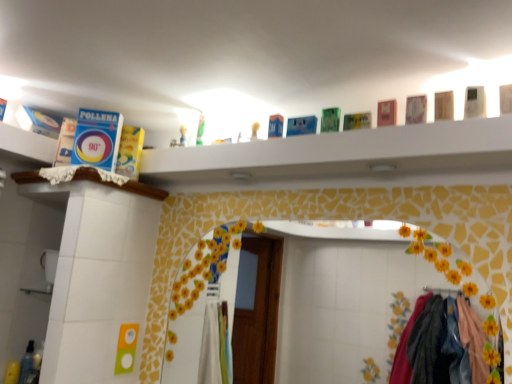
The height and width of the screenshot is (384, 512). Describe the element at coordinates (122, 185) in the screenshot. I see `wooden ledge at upper left, the 2th ledge viewed from the top` at that location.

Describe the element at coordinates (341, 153) in the screenshot. I see `blue cardboard box at upper center, arranged as the first ledge when viewed from the top` at that location.

Where is `translucent plastic bottle at lower left`? Image resolution: width=512 pixels, height=384 pixels. translucent plastic bottle at lower left is located at coordinates (27, 365).

Can you confirm if wooden ledge at upper left, the 2th ledge viewed from the top, is positioned to the right of translucent plastic bottle at lower left?

Yes, wooden ledge at upper left, the 2th ledge viewed from the top, is to the right of translucent plastic bottle at lower left.

Is translucent plastic bottle at lower left a part of wooden ledge at upper left, marked as the 1th ledge in a bottom-to-top arrangement?

No, translucent plastic bottle at lower left is not a part of wooden ledge at upper left, marked as the 1th ledge in a bottom-to-top arrangement.

Considering the sizes of objects wooden ledge at upper left, marked as the 1th ledge in a bottom-to-top arrangement, and translucent plastic bottle at lower left in the image provided, who is shorter, wooden ledge at upper left, marked as the 1th ledge in a bottom-to-top arrangement, or translucent plastic bottle at lower left?

wooden ledge at upper left, marked as the 1th ledge in a bottom-to-top arrangement, is shorter.

Is point (161, 197) positioned in front of point (28, 355)?

No.

Consider the image. Is blue cardboard box at upper center, arranged as the first ledge when viewed from the top, in front of or behind translucent plastic bottle at lower left in the image?

In the image, blue cardboard box at upper center, arranged as the first ledge when viewed from the top, appears in front of translucent plastic bottle at lower left.

Is blue cardboard box at upper center, arranged as the first ledge when viewed from the top, wider or thinner than translucent plastic bottle at lower left?

blue cardboard box at upper center, arranged as the first ledge when viewed from the top, is wider than translucent plastic bottle at lower left.

Is blue cardboard box at upper center, arranged as the first ledge when viewed from the top, taller than translucent plastic bottle at lower left?

In fact, blue cardboard box at upper center, arranged as the first ledge when viewed from the top, may be shorter than translucent plastic bottle at lower left.

Is blue cardboard box at upper center, placed as the 2th ledge when sorted from bottom to top, inside or outside of translucent plastic bottle at lower left?

blue cardboard box at upper center, placed as the 2th ledge when sorted from bottom to top, cannot be found inside translucent plastic bottle at lower left.

Does white mosaic mirror at center come in front of blue cardboard box at upper center, placed as the 2th ledge when sorted from bottom to top?

No.

Looking at the image, does white mosaic mirror at center seem bigger or smaller compared to blue cardboard box at upper center, placed as the 2th ledge when sorted from bottom to top?

Clearly, white mosaic mirror at center is smaller in size than blue cardboard box at upper center, placed as the 2th ledge when sorted from bottom to top.

Find the location of a particular element. This screenshot has height=384, width=512. mirror that appears behind the blue cardboard box at upper center, placed as the 2th ledge when sorted from bottom to top is located at coordinates (341, 298).

Considering the sizes of objects translucent plastic bottle at lower left and blue cardboard box at upper center, arranged as the first ledge when viewed from the top, in the image provided, who is taller, translucent plastic bottle at lower left or blue cardboard box at upper center, arranged as the first ledge when viewed from the top,?

translucent plastic bottle at lower left.

In terms of width, does translucent plastic bottle at lower left look wider or thinner when compared to blue cardboard box at upper center, placed as the 2th ledge when sorted from bottom to top?

Considering their sizes, translucent plastic bottle at lower left looks slimmer than blue cardboard box at upper center, placed as the 2th ledge when sorted from bottom to top.

At what (x,y) coordinates should I click in order to perform the action: click on toiletry below the blue cardboard box at upper center, arranged as the first ledge when viewed from the top (from the image's perspective). Please return your answer as a coordinate pair (x, y). Looking at the image, I should click on (x=27, y=365).

Which is less distant, (26, 362) or (318, 163)?

Point (26, 362).

Considering the sizes of translucent plastic bottle at lower left and wooden ledge at upper left, marked as the 1th ledge in a bottom-to-top arrangement, in the image, is translucent plastic bottle at lower left wider or thinner than wooden ledge at upper left, marked as the 1th ledge in a bottom-to-top arrangement,?

Considering their sizes, translucent plastic bottle at lower left looks slimmer than wooden ledge at upper left, marked as the 1th ledge in a bottom-to-top arrangement.

From a real-world perspective, relative to wooden ledge at upper left, marked as the 1th ledge in a bottom-to-top arrangement, is translucent plastic bottle at lower left vertically above or below?

From a real-world perspective, translucent plastic bottle at lower left is physically below wooden ledge at upper left, marked as the 1th ledge in a bottom-to-top arrangement.

The width and height of the screenshot is (512, 384). I want to click on toiletry located on the left of wooden ledge at upper left, marked as the 1th ledge in a bottom-to-top arrangement, so click(27, 365).

Do you think translucent plastic bottle at lower left is within wooden ledge at upper left, the 2th ledge viewed from the top, or outside of it?

translucent plastic bottle at lower left is not enclosed by wooden ledge at upper left, the 2th ledge viewed from the top.

Is wooden ledge at upper left, the 2th ledge viewed from the top, at the right side of blue cardboard box at upper center, placed as the 2th ledge when sorted from bottom to top?

Incorrect, wooden ledge at upper left, the 2th ledge viewed from the top, is not on the right side of blue cardboard box at upper center, placed as the 2th ledge when sorted from bottom to top.

From the image's perspective, would you say wooden ledge at upper left, marked as the 1th ledge in a bottom-to-top arrangement, is shown under blue cardboard box at upper center, arranged as the first ledge when viewed from the top?

Correct, wooden ledge at upper left, marked as the 1th ledge in a bottom-to-top arrangement, appears lower than blue cardboard box at upper center, arranged as the first ledge when viewed from the top, in the image.

At what (x,y) coordinates should I click in order to perform the action: click on ledge that appears above the wooden ledge at upper left, the 2th ledge viewed from the top (from a real-world perspective). Please return your answer as a coordinate pair (x, y). Image resolution: width=512 pixels, height=384 pixels. Looking at the image, I should click on (341, 153).

Considering the relative sizes of wooden ledge at upper left, the 2th ledge viewed from the top, and blue cardboard box at upper center, placed as the 2th ledge when sorted from bottom to top, in the image provided, is wooden ledge at upper left, the 2th ledge viewed from the top, thinner than blue cardboard box at upper center, placed as the 2th ledge when sorted from bottom to top,?

In fact, wooden ledge at upper left, the 2th ledge viewed from the top, might be wider than blue cardboard box at upper center, placed as the 2th ledge when sorted from bottom to top.

From the image's perspective, is blue cardboard box at upper center, placed as the 2th ledge when sorted from bottom to top, above wooden ledge at upper left, marked as the 1th ledge in a bottom-to-top arrangement?

Yes, from the image's perspective, blue cardboard box at upper center, placed as the 2th ledge when sorted from bottom to top, is on top of wooden ledge at upper left, marked as the 1th ledge in a bottom-to-top arrangement.

The width and height of the screenshot is (512, 384). Identify the location of ledge that is below the blue cardboard box at upper center, placed as the 2th ledge when sorted from bottom to top (from the image's perspective). (122, 185).

Considering the sizes of blue cardboard box at upper center, arranged as the first ledge when viewed from the top, and wooden ledge at upper left, marked as the 1th ledge in a bottom-to-top arrangement, in the image, is blue cardboard box at upper center, arranged as the first ledge when viewed from the top, wider or thinner than wooden ledge at upper left, marked as the 1th ledge in a bottom-to-top arrangement,?

blue cardboard box at upper center, arranged as the first ledge when viewed from the top, is thinner than wooden ledge at upper left, marked as the 1th ledge in a bottom-to-top arrangement.

In order to click on toiletry below the wooden ledge at upper left, marked as the 1th ledge in a bottom-to-top arrangement (from the image's perspective) in this screenshot , I will do `click(27, 365)`.

Identify the location of toiletry behind the blue cardboard box at upper center, arranged as the first ledge when viewed from the top. This screenshot has height=384, width=512. (27, 365).

Estimate the real-world distances between objects in this image. Which object is closer to blue cardboard box at upper center, arranged as the first ledge when viewed from the top, translucent plastic bottle at lower left or wooden ledge at upper left, marked as the 1th ledge in a bottom-to-top arrangement?

Among the two, wooden ledge at upper left, marked as the 1th ledge in a bottom-to-top arrangement, is located nearer to blue cardboard box at upper center, arranged as the first ledge when viewed from the top.

Estimate the real-world distances between objects in this image. Which object is further from wooden ledge at upper left, the 2th ledge viewed from the top, white mosaic mirror at center or translucent plastic bottle at lower left?

Based on the image, white mosaic mirror at center appears to be further to wooden ledge at upper left, the 2th ledge viewed from the top.

Which object lies further to the anchor point wooden ledge at upper left, the 2th ledge viewed from the top, white mosaic mirror at center or blue cardboard box at upper center, placed as the 2th ledge when sorted from bottom to top?

Among the two, white mosaic mirror at center is located further to wooden ledge at upper left, the 2th ledge viewed from the top.

Considering their positions, is blue cardboard box at upper center, placed as the 2th ledge when sorted from bottom to top, positioned closer to wooden ledge at upper left, the 2th ledge viewed from the top, than translucent plastic bottle at lower left?

Based on the image, blue cardboard box at upper center, placed as the 2th ledge when sorted from bottom to top, appears to be nearer to wooden ledge at upper left, the 2th ledge viewed from the top.

In the scene shown: Estimate the real-world distances between objects in this image. Which object is further from translucent plastic bottle at lower left, wooden ledge at upper left, marked as the 1th ledge in a bottom-to-top arrangement, or white mosaic mirror at center?

Based on the image, white mosaic mirror at center appears to be further to translucent plastic bottle at lower left.

Which object lies further to the anchor point white mosaic mirror at center, blue cardboard box at upper center, arranged as the first ledge when viewed from the top, or translucent plastic bottle at lower left?

The object further to white mosaic mirror at center is translucent plastic bottle at lower left.

Estimate the real-world distances between objects in this image. Which object is closer to blue cardboard box at upper center, placed as the 2th ledge when sorted from bottom to top, white mosaic mirror at center or wooden ledge at upper left, marked as the 1th ledge in a bottom-to-top arrangement?

Among the two, wooden ledge at upper left, marked as the 1th ledge in a bottom-to-top arrangement, is located nearer to blue cardboard box at upper center, placed as the 2th ledge when sorted from bottom to top.

Considering their positions, is wooden ledge at upper left, the 2th ledge viewed from the top, positioned further to white mosaic mirror at center than blue cardboard box at upper center, arranged as the first ledge when viewed from the top?

Based on the image, wooden ledge at upper left, the 2th ledge viewed from the top, appears to be further to white mosaic mirror at center.

Find the location of a particular element. ledge between translucent plastic bottle at lower left and blue cardboard box at upper center, arranged as the first ledge when viewed from the top is located at coordinates (122, 185).

Identify the location of ledge between wooden ledge at upper left, marked as the 1th ledge in a bottom-to-top arrangement, and white mosaic mirror at center, in the horizontal direction. The image size is (512, 384). (341, 153).